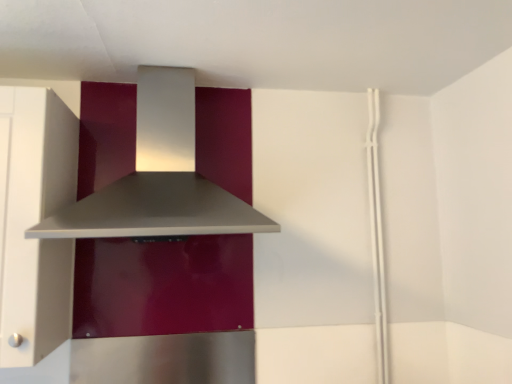
Where is `free space above metallic gray range hood at center (from a real-world perspective)`? free space above metallic gray range hood at center (from a real-world perspective) is located at coordinates (170, 52).